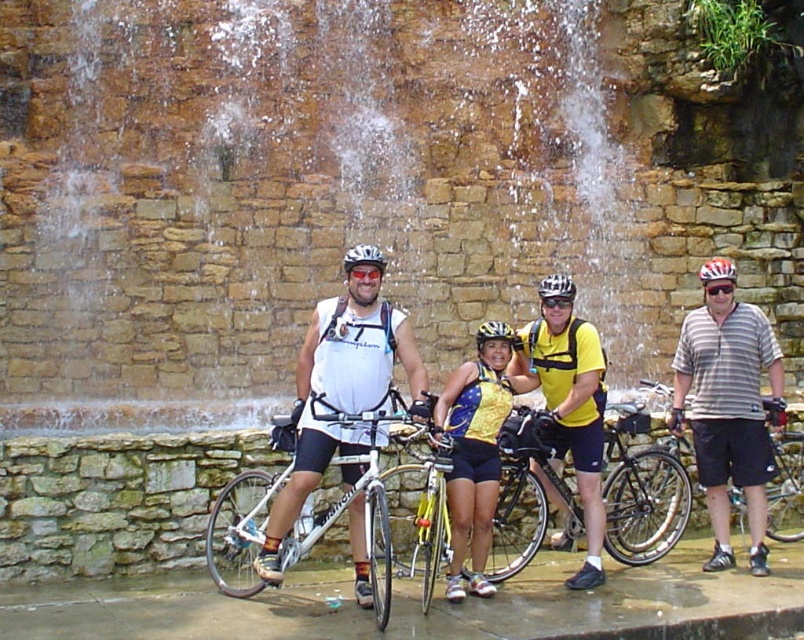
Question: Which object is positioned farthest from the shiny metallic bicycle at center?

Choices:
 (A) black matte bicycle helmet at center
 (B) yellow shiny tank top at center
 (C) matte black goggles at center
 (D) yellow matte shirt at center

Answer: (A)

Question: Is matte black helmet at center to the left of matte white helmet at center from the viewer's perspective?

Choices:
 (A) no
 (B) yes

Answer: (A)

Question: Which object is the farthest from the black matte goggles at center?

Choices:
 (A) gold metallic bicycle at center
 (B) matte white helmet at center
 (C) silver metallic bicycle at center

Answer: (C)

Question: In this image, where is yellow matte shirt at center located relative to black matte goggles at center?

Choices:
 (A) below
 (B) above

Answer: (A)

Question: Which object appears closest to the camera in this image?

Choices:
 (A) white matte helmet at center
 (B) white metallic bicycle at center

Answer: (B)

Question: Considering the relative positions of gold metallic bicycle at center and black reflective goggles at center in the image provided, where is gold metallic bicycle at center located with respect to black reflective goggles at center?

Choices:
 (A) left
 (B) right

Answer: (A)